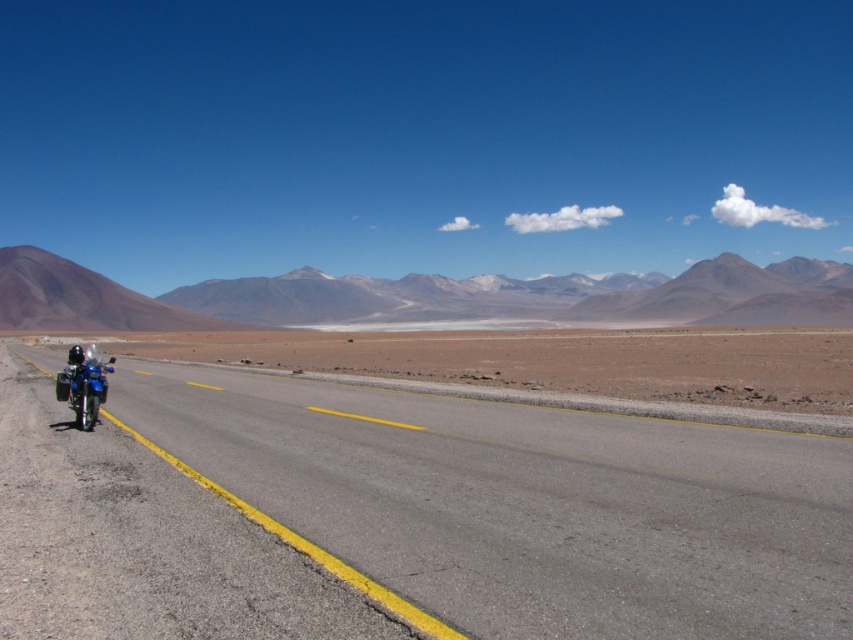
You are a driver planning to park your car on the smooth asphalt road at center. You notice the blue metallic motorbike at left is already parked there. Can you fit your car next to the motorbike without overlapping?

The smooth asphalt road at center is shorter than the blue metallic motorbike at left, so there might not be enough space to park your car next to the motorbike without overlapping.

You are driving a car that is 4 meters long and want to safely pass a motorcycle parked on the left side of the smooth asphalt road at center. Can your car fit in the passing lane without hitting the motorcycle?

The distance between the car and the motorcycle is 4.17 meters, so yes, the car can safely pass the motorcycle parked on the left side of the smooth asphalt road at center as the available space is slightly more than the car length.

Looking at this image, you are a delivery driver who needs to turn around your blue metallic motorbike at left to head back. The road is narrow. Can you safely turn around on the smooth asphalt road at center without leaving the road?

The smooth asphalt road at center is positioned on the right side of blue metallic motorbike at left. Since the road is narrow and the motorbike is already on the left side of the road, turning around might require moving to the right side of the road. However, the road is only wide enough for two way traffic with the dividing line in the center. Therefore, turning around might be possible by using the opposite lane if clear, but depends on traffic conditions not mentioned here.